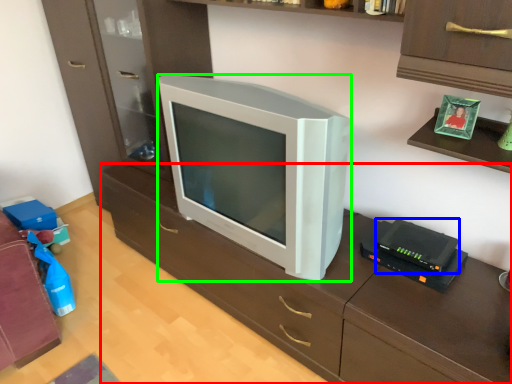
Question: Considering the real-world distances, which object is farthest from computer desk (highlighted by a red box)? gadget (highlighted by a blue box) or television (highlighted by a green box)?

Choices:
 (A) gadget
 (B) television

Answer: (A)